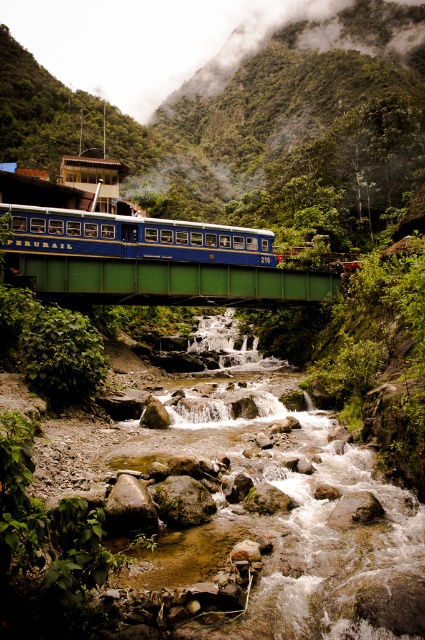
Which is below, green painted metal bridge at center or blue polished wood passenger train at center?

Positioned lower is green painted metal bridge at center.

Who is higher up, green painted metal bridge at center or blue polished wood passenger train at center?

Positioned higher is blue polished wood passenger train at center.

Who is more forward, (90, 280) or (79, 248)?

Point (90, 280) is more forward.

Locate an element on the screen. green painted metal bridge at center is located at coordinates (166, 282).